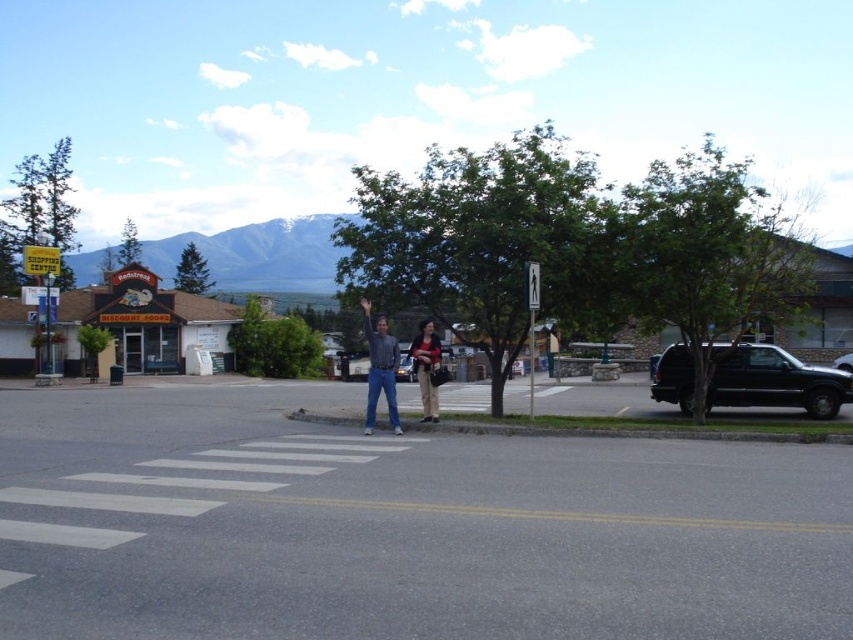
Question: Does white matte building at left appear over black matte suv at center?

Choices:
 (A) yes
 (B) no

Answer: (A)

Question: Can you confirm if white matte building at left is positioned above white plastic pedestrian sign at center?

Choices:
 (A) yes
 (B) no

Answer: (A)

Question: Which point is farther to the camera?

Choices:
 (A) denim jeans at center
 (B) white plastic pedestrian sign at center
 (C) metallic silver car at center
 (D) black matte suv at center

Answer: (D)

Question: Among these objects, which one is nearest to the camera?

Choices:
 (A) metallic silver car at center
 (B) black matte suv at center
 (C) white matte building at left
 (D) white plastic pedestrian sign at center

Answer: (A)

Question: Which is nearer to the black matte suv at right?

Choices:
 (A) denim jeans at center
 (B) snowy mountain range at upper center
 (C) white plastic pedestrian sign at center

Answer: (C)

Question: Does matte black jacket at center appear under white plastic pedestrian sign at center?

Choices:
 (A) yes
 (B) no

Answer: (A)